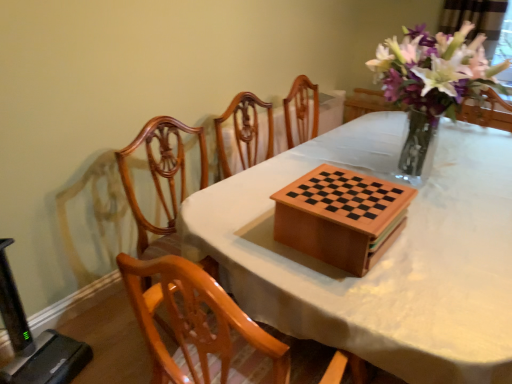
This screenshot has width=512, height=384. Describe the element at coordinates (162, 180) in the screenshot. I see `polished wood chair at center` at that location.

The image size is (512, 384). I want to click on wooden chess set at center, so click(249, 133).

The image size is (512, 384). What do you see at coordinates (479, 23) in the screenshot?
I see `translucent glass vase at upper right` at bounding box center [479, 23].

Describe the element at coordinates (382, 257) in the screenshot. I see `wooden table at center` at that location.

The height and width of the screenshot is (384, 512). Find the location of `polished wood chair at center`. polished wood chair at center is located at coordinates point(162,180).

Is wooden table at center next to wooden checkered board at center and touching it?

No, wooden table at center is not making contact with wooden checkered board at center.

Is wooden table at center in front of or behind wooden checkered board at center in the image?

In the image, wooden table at center appears in front of wooden checkered board at center.

From a real-world perspective, relative to wooden checkered board at center, is wooden table at center vertically above or below?

From a real-world perspective, wooden table at center is physically below wooden checkered board at center.

In the image, is translucent glass vase at upper right positioned in front of or behind polished wood chair at center?

Visually, translucent glass vase at upper right is located behind polished wood chair at center.

Would you consider translucent glass vase at upper right to be distant from polished wood chair at center?

Yes, translucent glass vase at upper right and polished wood chair at center are quite far apart.

Is translucent glass vase at upper right to the right of polished wood chair at center from the viewer's perspective?

Yes.

From a real-world perspective, is translucent glass vase at upper right physically above polished wood chair at center?

Yes, from a real-world perspective, translucent glass vase at upper right is on top of polished wood chair at center.

Is point (324, 167) in front of point (499, 203)?

Yes.

Which of these two, wooden checkered board at center or wooden table at center, is bigger?

With larger size is wooden table at center.

Who is shorter, wooden checkered board at center or wooden table at center?

With less height is wooden checkered board at center.

Considering the relative positions of wooden checkered board at center and wooden table at center in the image provided, is wooden checkered board at center to the left or to the right of wooden table at center?

Clearly, wooden checkered board at center is on the left of wooden table at center in the image.

Looking at this image, from a real-world perspective, is translucent glass vase at upper right beneath wooden table at center?

No.

Does translucent glass vase at upper right have a larger size compared to wooden table at center?

No.

In order to click on window screen above the wooden table at center (from a real-world perspective) in this screenshot , I will do `click(479, 23)`.

How different are the orientations of translucent glass vase at upper right and wooden table at center in degrees?

translucent glass vase at upper right and wooden table at center are facing 178 degrees away from each other.

Image resolution: width=512 pixels, height=384 pixels. What are the coordinates of `table that appears below the polished wood chair at center (from the image's perspective)` in the screenshot? It's located at (382, 257).

From the picture: Does polished wood chair at center touch wooden table at center?

No, polished wood chair at center is not in contact with wooden table at center.

From a real-world perspective, which is physically below, polished wood chair at center or wooden table at center?

From a 3D spatial view, wooden table at center is below.

From the picture: Is wooden table at center turned away from translucent glass vase at upper right?

wooden table at center is not turned away from translucent glass vase at upper right.

Find the location of a particular element. window screen on the right of wooden table at center is located at coordinates (479, 23).

Based on the photo, does wooden table at center have a lesser width compared to translucent glass vase at upper right?

Incorrect, the width of wooden table at center is not less than that of translucent glass vase at upper right.

Is wooden table at center at the left side of translucent glass vase at upper right?

Yes, wooden table at center is to the left of translucent glass vase at upper right.

In terms of size, does wooden chess set at center appear bigger or smaller than polished wood chair at center?

Clearly, wooden chess set at center is smaller in size than polished wood chair at center.

Does wooden chess set at center lie behind polished wood chair at center?

Yes.

In the scene shown: Which object is positioned more to the left, wooden chess set at center or polished wood chair at center?

polished wood chair at center.

Can you confirm if wooden chess set at center is wider than polished wood chair at center?

No.

You are a GUI agent. You are given a task and a screenshot of the screen. Output one action in this format:
    pyautogui.click(x=<x>, y=<y>)
    Task: Click on the board game lying on the left of wooden table at center
    
    Given the screenshot: What is the action you would take?
    pyautogui.click(x=341, y=217)

Image resolution: width=512 pixels, height=384 pixels. I want to click on window screen behind the polished wood chair at center, so click(x=479, y=23).

Consider the image. Considering their positions, is wooden checkered board at center positioned closer to polished wood chair at center than wooden table at center?

Among the two, wooden checkered board at center is located nearer to polished wood chair at center.

Estimate the real-world distances between objects in this image. Which object is closer to wooden chess set at center, polished wood chair at center or wooden checkered board at center?

Based on the image, polished wood chair at center appears to be nearer to wooden chess set at center.

Which object lies nearer to the anchor point wooden checkered board at center, translucent glass vase at upper right or wooden chess set at center?

wooden chess set at center is positioned closer to the anchor wooden checkered board at center.

From the image, which object appears to be farther from polished wood chair at center, wooden chess set at center or wooden table at center?

wooden table at center lies further to polished wood chair at center than the other object.

Estimate the real-world distances between objects in this image. Which object is further from wooden chess set at center, wooden checkered board at center or polished wood chair at center?

The object further to wooden chess set at center is wooden checkered board at center.

When comparing their distances from translucent glass vase at upper right, does wooden checkered board at center or polished wood chair at center seem further?

polished wood chair at center lies further to translucent glass vase at upper right than the other object.

Looking at the image, which one is located further to wooden checkered board at center, wooden chess set at center or polished wood chair at center?

wooden chess set at center lies further to wooden checkered board at center than the other object.

Estimate the real-world distances between objects in this image. Which object is further from polished wood chair at center, wooden chess set at center or translucent glass vase at upper right?

Among the two, translucent glass vase at upper right is located further to polished wood chair at center.

I want to click on board game between polished wood chair at center and wooden table at center from left to right, so click(341, 217).

The image size is (512, 384). What are the coordinates of `board game between wooden table at center and wooden chess set at center along the z-axis` in the screenshot? It's located at pos(341,217).

Find the location of a particular element. round table between wooden checkered board at center and translucent glass vase at upper right in the front-back direction is located at coordinates (249, 133).

At what (x,y) coordinates should I click in order to perform the action: click on board game between polished wood chair at center and translucent glass vase at upper right. Please return your answer as a coordinate pair (x, y). This screenshot has width=512, height=384. Looking at the image, I should click on (341, 217).